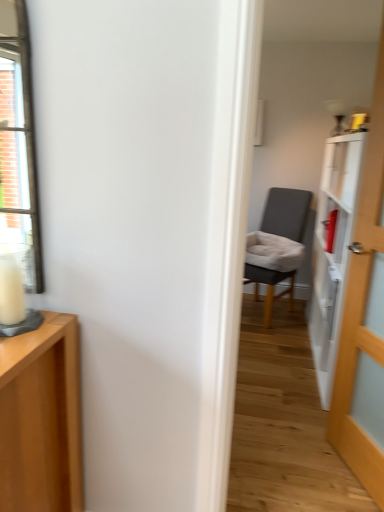
Question: Is dark gray fabric chair at center not near wooden door at right?

Choices:
 (A) no
 (B) yes

Answer: (B)

Question: Is the depth of dark gray fabric chair at center greater than that of wooden door at right?

Choices:
 (A) yes
 (B) no

Answer: (A)

Question: Does dark gray fabric chair at center have a greater height compared to wooden door at right?

Choices:
 (A) yes
 (B) no

Answer: (B)

Question: Considering the relative sizes of dark gray fabric chair at center and wooden door at right in the image provided, is dark gray fabric chair at center shorter than wooden door at right?

Choices:
 (A) no
 (B) yes

Answer: (B)

Question: Is dark gray fabric chair at center aimed at wooden door at right?

Choices:
 (A) no
 (B) yes

Answer: (A)

Question: In terms of width, does dark gray fabric chair at center look wider or thinner when compared to white wax candle at left?

Choices:
 (A) thin
 (B) wide

Answer: (B)

Question: From the image's perspective, is dark gray fabric chair at center located above or below white wax candle at left?

Choices:
 (A) above
 (B) below

Answer: (A)

Question: Is dark gray fabric chair at center in front of or behind white wax candle at left in the image?

Choices:
 (A) behind
 (B) front

Answer: (A)

Question: From a real-world perspective, is dark gray fabric chair at center above or below white wax candle at left?

Choices:
 (A) below
 (B) above

Answer: (A)

Question: Relative to dark gray fabric chair at center, is white wax candle at left in front or behind?

Choices:
 (A) behind
 (B) front

Answer: (B)

Question: In the image, is white wax candle at left on the left side or the right side of dark gray fabric chair at center?

Choices:
 (A) left
 (B) right

Answer: (A)

Question: Choose the correct answer: Is white wax candle at left inside dark gray fabric chair at center or outside it?

Choices:
 (A) outside
 (B) inside

Answer: (A)

Question: From a real-world perspective, is white wax candle at left above or below dark gray fabric chair at center?

Choices:
 (A) above
 (B) below

Answer: (A)

Question: Considering the positions of wooden door at right and dark gray fabric chair at center in the image, is wooden door at right taller or shorter than dark gray fabric chair at center?

Choices:
 (A) short
 (B) tall

Answer: (B)

Question: Does point (365, 197) appear closer or farther from the camera than point (268, 326)?

Choices:
 (A) farther
 (B) closer

Answer: (B)